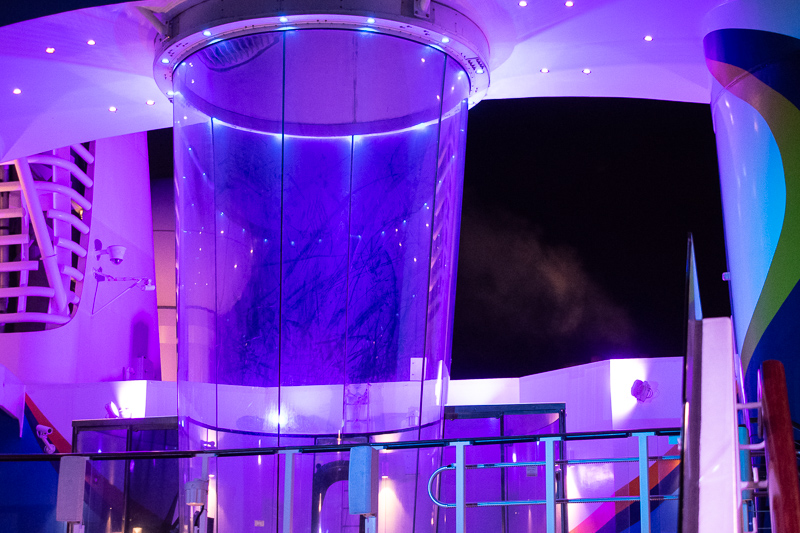
You are a GUI agent. You are given a task and a screenshot of the screen. Output one action in this format:
    pyautogui.click(x=<x>, y=<y>)
    Task: Click on the door way
    The height and width of the screenshot is (533, 800).
    Given the screenshot: What is the action you would take?
    pyautogui.click(x=134, y=484), pyautogui.click(x=496, y=456)